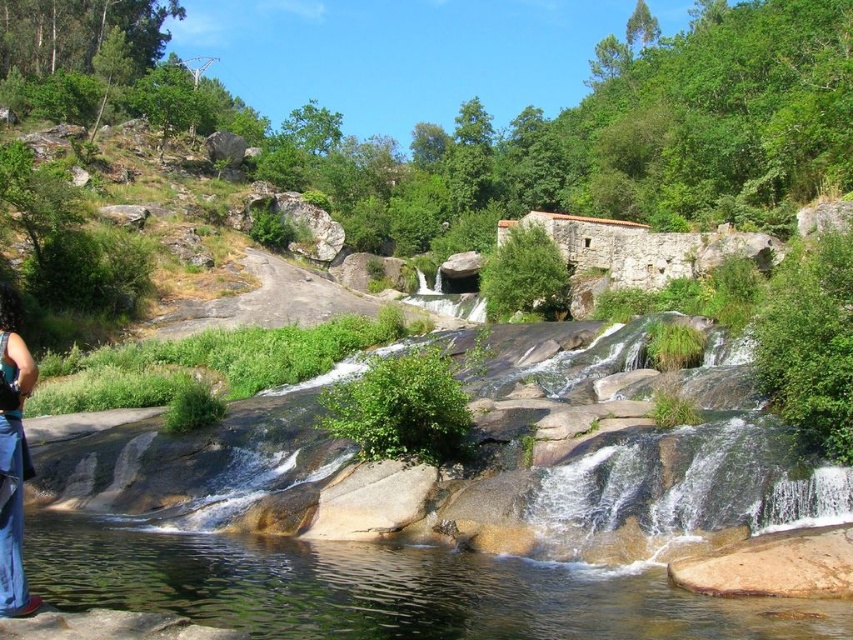
You are standing at the point labeled as point (x=387, y=589) in the image. Looking around, you see clear water at lower left. Based on the scene description, what is the immediate environment around your current position?

The point (x=387, y=589) corresponds to clear water at lower left, so the immediate environment around your current position is clear water.

You are standing at the edge of the waterfall and see the clear water at lower left and the blue denim dress at lower left. Which object is positioned more to the right?

The clear water at lower left is positioned more to the right than the blue denim dress at lower left.

You are standing at the base of the waterfall and see two points marked in the scene. The first point is at coordinates point (428,616) and the second is at point (7,540). Which point is closer to you?

Point (428,616) is further to the viewer than point (7,540), so the second point is closer to you.